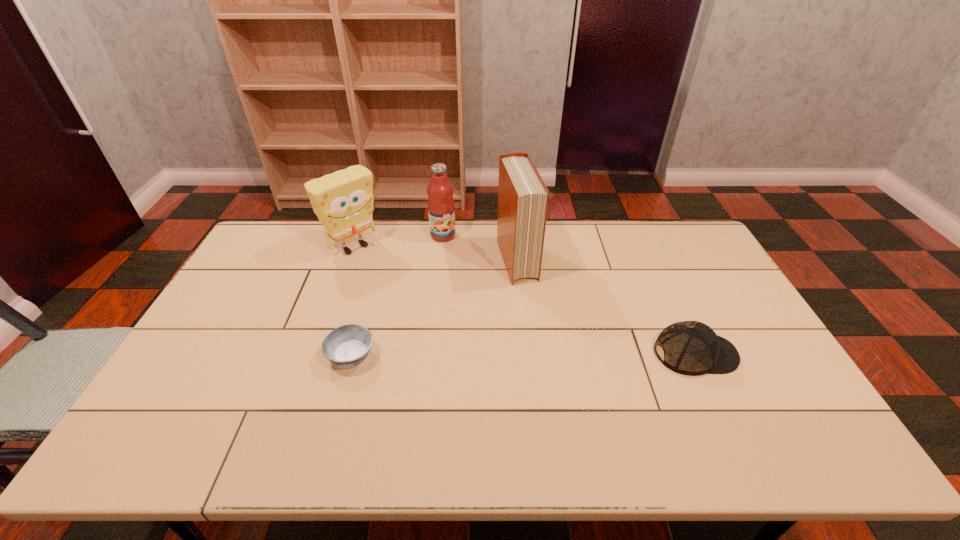
Find the location of a particular element. The height and width of the screenshot is (540, 960). vacant space located on the open cover of the tallest object is located at coordinates (533, 314).

Identify the location of vacant space positioned 0.350m on the open cover of the tallest object. The image size is (960, 540). (555, 372).

Locate an element on the screen. This screenshot has height=540, width=960. free space located 0.310m on the front label of the third object from right to left is located at coordinates (475, 298).

Where is `free location located 0.380m on the front label of the third object from right to left`? The width and height of the screenshot is (960, 540). free location located 0.380m on the front label of the third object from right to left is located at coordinates (483, 313).

Locate an element on the screen. vacant region located 0.190m on the front label of the third object from right to left is located at coordinates (463, 274).

Where is `free region located 0.230m on the face of the sponge`? free region located 0.230m on the face of the sponge is located at coordinates (407, 293).

The image size is (960, 540). I want to click on blank area located 0.400m on the face of the sponge, so click(440, 322).

Locate an element on the screen. The height and width of the screenshot is (540, 960). free space located on the face of the sponge is located at coordinates (411, 296).

At what (x,y) coordinates should I click in order to perform the action: click on hardback book located at the far edge. Please return your answer as a coordinate pair (x, y). Looking at the image, I should click on (523, 197).

Where is `fruit juice that is at the far edge`? The height and width of the screenshot is (540, 960). fruit juice that is at the far edge is located at coordinates (441, 209).